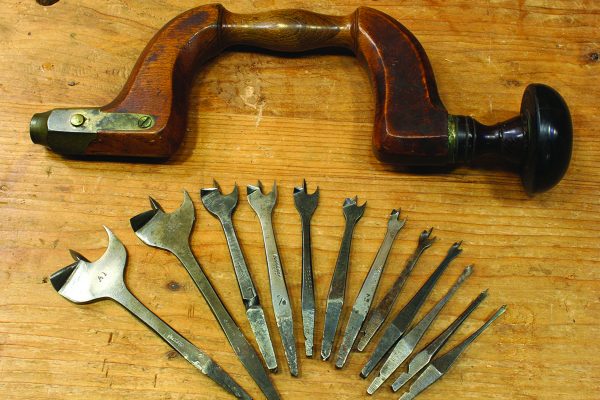
The width and height of the screenshot is (600, 400). Find the location of `knots in wood`. knots in wood is located at coordinates (593, 60), (176, 354), (174, 289).